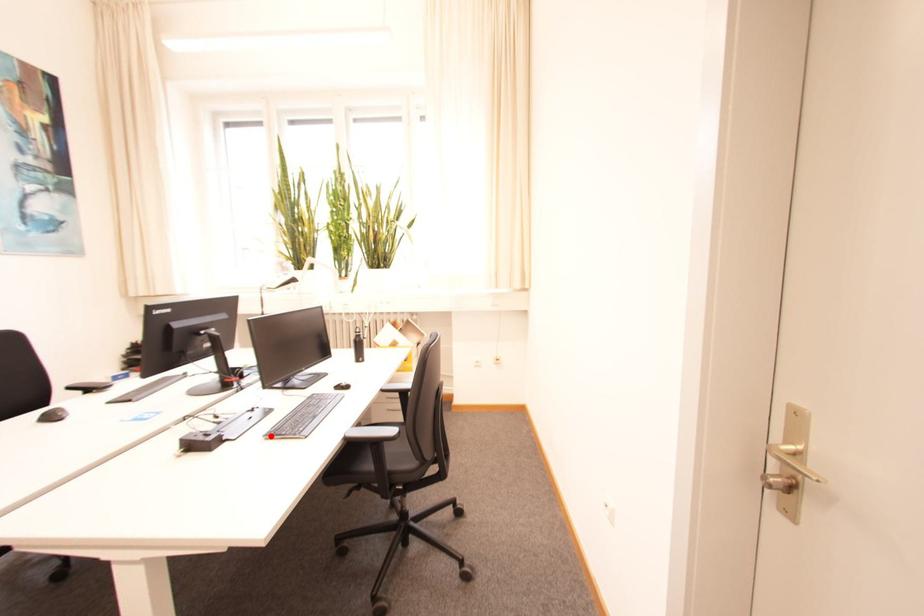
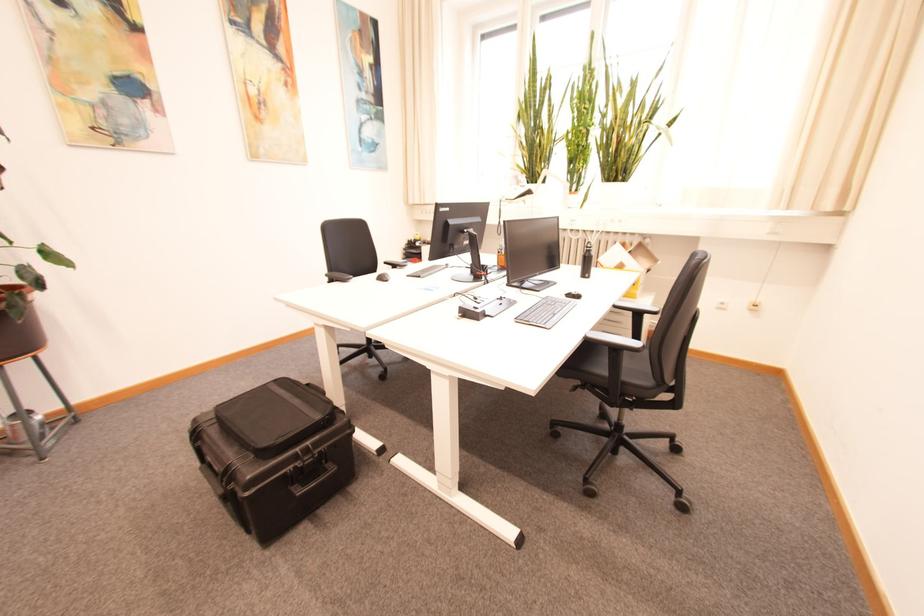
Find the pixel in the second image that matches the highlighted location in the first image.

(523, 320)